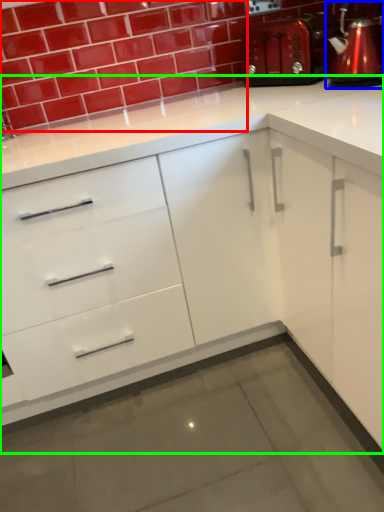
Question: Which object is the closest to the brick (highlighted by a red box)? Choose among these: coffeepot (highlighted by a blue box) or cabinetry (highlighted by a green box).

Choices:
 (A) coffeepot
 (B) cabinetry

Answer: (A)